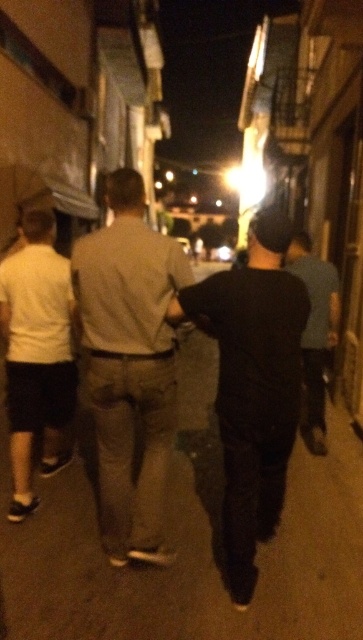
Question: Considering the real-world distances, which object is closest to the black matte shirt at center?

Choices:
 (A) dark gray pants at center
 (B) light brown denim pants at center
 (C) white matte shirt at left
 (D) dark asphalt pavement at center

Answer: (B)

Question: Is black matte shirt at center wider than dark gray pants at center?

Choices:
 (A) no
 (B) yes

Answer: (B)

Question: Does light brown denim pants at center appear on the left side of white matte shirt at left?

Choices:
 (A) yes
 (B) no

Answer: (B)

Question: Does light brown denim pants at center appear on the left side of dark gray pants at center?

Choices:
 (A) no
 (B) yes

Answer: (B)

Question: Which point appears closest to the camera in this image?

Choices:
 (A) (116, 195)
 (B) (271, 380)

Answer: (B)

Question: Which point is closer to the camera taking this photo?

Choices:
 (A) (312, 392)
 (B) (131, 632)
 (C) (66, 369)

Answer: (B)